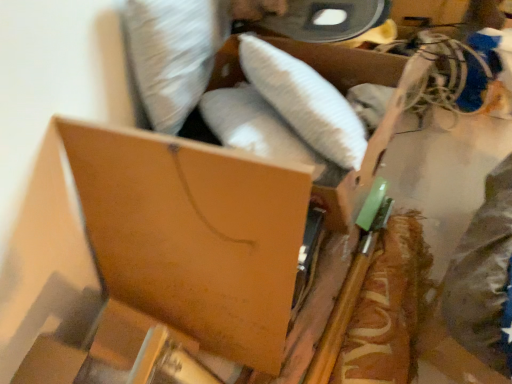
Question: Considering the relative positions of wooden spatula at right and brown cardboard box at center, the 1th storage box in the bottom-to-top sequence, in the image provided, is wooden spatula at right to the left of brown cardboard box at center, the 1th storage box in the bottom-to-top sequence, from the viewer's perspective?

Choices:
 (A) no
 (B) yes

Answer: (A)

Question: From a real-world perspective, is wooden spatula at right on top of brown cardboard box at center, the 1th storage box in the bottom-to-top sequence?

Choices:
 (A) yes
 (B) no

Answer: (B)

Question: From a real-world perspective, is wooden spatula at right positioned under brown cardboard box at center, the 1th storage box in the bottom-to-top sequence, based on gravity?

Choices:
 (A) yes
 (B) no

Answer: (A)

Question: Could you tell me if wooden spatula at right is facing brown cardboard box at center, the 1th storage box in the bottom-to-top sequence?

Choices:
 (A) yes
 (B) no

Answer: (B)

Question: Is wooden spatula at right facing away from brown cardboard box at center, which is the 2th storage box from top to bottom?

Choices:
 (A) no
 (B) yes

Answer: (A)

Question: Relative to wooden spatula at right, is brown cardboard box at center, which is the 2th storage box from top to bottom, in front or behind?

Choices:
 (A) front
 (B) behind

Answer: (A)

Question: Which is correct: brown cardboard box at center, which is the 2th storage box from top to bottom, is inside wooden spatula at right, or outside of it?

Choices:
 (A) outside
 (B) inside

Answer: (A)

Question: In terms of size, does brown cardboard box at center, the 1th storage box in the bottom-to-top sequence, appear bigger or smaller than wooden spatula at right?

Choices:
 (A) small
 (B) big

Answer: (B)

Question: In the image, is brown cardboard box at center, which is the 2th storage box from top to bottom, on the left side or the right side of wooden spatula at right?

Choices:
 (A) left
 (B) right

Answer: (A)

Question: Does point (373, 157) appear closer or farther from the camera than point (409, 266)?

Choices:
 (A) closer
 (B) farther

Answer: (A)

Question: Considering the relative positions of brown cardboard box at upper center, which ranks as the first storage box in top-to-bottom order, and wooden spatula at right in the image provided, is brown cardboard box at upper center, which ranks as the first storage box in top-to-bottom order, to the left or to the right of wooden spatula at right?

Choices:
 (A) right
 (B) left

Answer: (B)

Question: Is brown cardboard box at upper center, acting as the 2th storage box starting from the bottom, bigger or smaller than wooden spatula at right?

Choices:
 (A) small
 (B) big

Answer: (B)

Question: From a real-world perspective, relative to wooden spatula at right, is brown cardboard box at upper center, acting as the 2th storage box starting from the bottom, vertically above or below?

Choices:
 (A) above
 (B) below

Answer: (A)

Question: From a real-world perspective, is brown cardboard box at center, which is the 2th storage box from top to bottom, above or below brown cardboard box at upper center, acting as the 2th storage box starting from the bottom?

Choices:
 (A) below
 (B) above

Answer: (A)

Question: Is point (232, 317) closer or farther from the camera than point (359, 183)?

Choices:
 (A) farther
 (B) closer

Answer: (A)